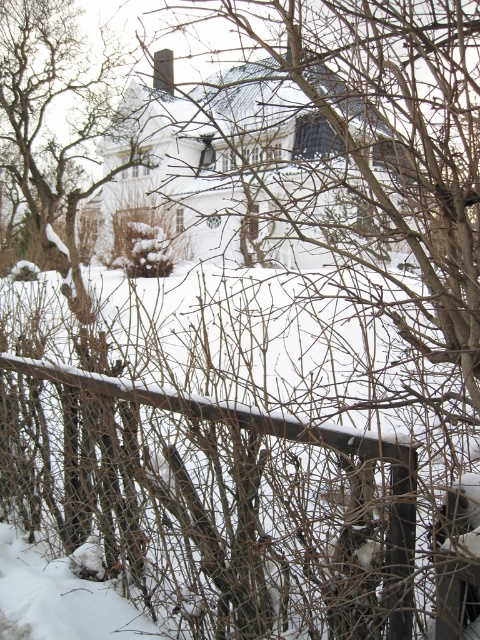
Is point (104, 122) positioned before point (187, 410)?

No, it is not.

Find the location of a particular element. brown textured tree at upper left is located at coordinates (48, 125).